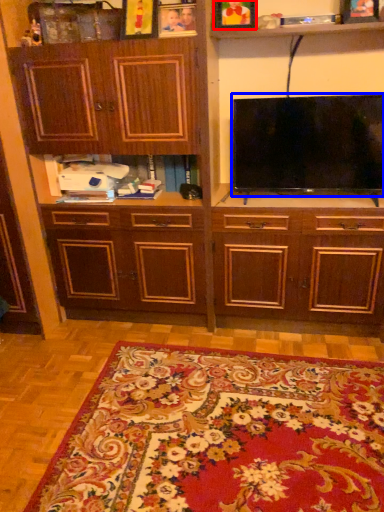
Question: Which point is further to the camera, picture frame (highlighted by a red box) or television (highlighted by a blue box)?

Choices:
 (A) picture frame
 (B) television

Answer: (A)